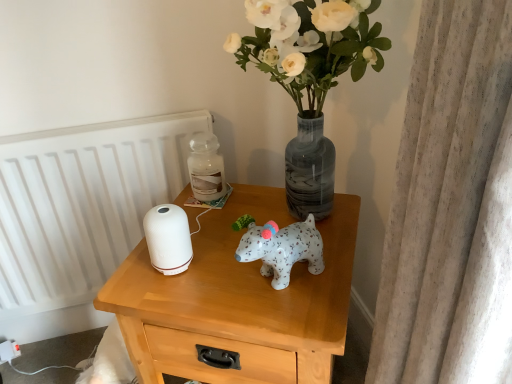
Where is `translucent glass jar at upper center`? translucent glass jar at upper center is located at coordinates (206, 168).

Identify the location of white glossy radiator at left. This screenshot has width=512, height=384. (83, 203).

What do you see at coordinates (310, 46) in the screenshot? I see `white matte vase at upper center` at bounding box center [310, 46].

Where is `translucent glass jar at upper center`? The width and height of the screenshot is (512, 384). translucent glass jar at upper center is located at coordinates (206, 168).

Does white glossy radiator at left turn towards translucent glass jar at upper center?

Yes.

Looking at this image, from the image's perspective, which object appears higher, white glossy radiator at left or translucent glass jar at upper center?

Answer: translucent glass jar at upper center is shown above in the image.

From the picture: Is white glossy radiator at left inside or outside of translucent glass jar at upper center?

white glossy radiator at left is located beyond the bounds of translucent glass jar at upper center.

From the picture: Is white glossy radiator at left wider or thinner than translucent glass jar at upper center?

Considering their sizes, white glossy radiator at left looks slimmer than translucent glass jar at upper center.

Considering the relative positions of white matte nightstand at center and white glossy radiator at left in the image provided, is white matte nightstand at center behind white glossy radiator at left?

No, white matte nightstand at center is closer to the viewer.

From the image's perspective, is white matte nightstand at center located above or below white glossy radiator at left?

From the image's perspective, white matte nightstand at center appears below white glossy radiator at left.

Is white matte nightstand at center taller than white glossy radiator at left?

In fact, white matte nightstand at center may be shorter than white glossy radiator at left.

Can you confirm if white matte nightstand at center is thinner than white glossy radiator at left?

No.

How much distance is there between white matte vase at upper center and white glossy radiator at left?

The distance of white matte vase at upper center from white glossy radiator at left is 21.70 inches.

From a real-world perspective, is white matte vase at upper center under white glossy radiator at left?

No, from a real-world perspective, white matte vase at upper center is not below white glossy radiator at left.

Can you confirm if white matte vase at upper center is wider than white glossy radiator at left?

Indeed, white matte vase at upper center has a greater width compared to white glossy radiator at left.

Choose the correct answer: Is white matte vase at upper center inside white glossy radiator at left or outside it?

white matte vase at upper center is outside white glossy radiator at left.

Is translucent glass jar at upper center aimed at white matte nightstand at center?

No, translucent glass jar at upper center is not facing towards white matte nightstand at center.

Is point (198, 135) closer to camera compared to point (232, 211)?

No, it is not.

Who is taller, translucent glass jar at upper center or white matte nightstand at center?

white matte nightstand at center is taller.

Considering the relative sizes of white matte vase at upper center and translucent glass jar at upper center in the image provided, is white matte vase at upper center taller than translucent glass jar at upper center?

Yes, white matte vase at upper center is taller than translucent glass jar at upper center.

From a real-world perspective, which object rests below the other?

translucent glass jar at upper center is physically lower.

Considering the points (328, 53) and (215, 176), which point is behind, point (328, 53) or point (215, 176)?

Positioned behind is point (215, 176).

Who is smaller, translucent glass jar at upper center or white matte vase at upper center?

translucent glass jar at upper center.

Considering the sizes of objects translucent glass jar at upper center and white matte vase at upper center in the image provided, who is thinner, translucent glass jar at upper center or white matte vase at upper center?

translucent glass jar at upper center.

From the image's perspective, which one is positioned lower, translucent glass jar at upper center or white matte vase at upper center?

translucent glass jar at upper center.

Considering the positions of objects translucent glass jar at upper center and white matte vase at upper center in the image provided, who is in front, translucent glass jar at upper center or white matte vase at upper center?

white matte vase at upper center.

Could you tell me if white glossy radiator at left is facing white matte nightstand at center?

Yes, white glossy radiator at left is oriented towards white matte nightstand at center.

Considering the positions of point (165, 186) and point (329, 279), is point (165, 186) closer or farther from the camera than point (329, 279)?

Point (165, 186) is positioned farther from the camera compared to point (329, 279).

Is white glossy radiator at left at the left side of white matte nightstand at center?

Correct, you'll find white glossy radiator at left to the left of white matte nightstand at center.

The width and height of the screenshot is (512, 384). In order to click on radiator lying above the white matte nightstand at center (from the image's perspective) in this screenshot , I will do `click(83, 203)`.

Identify the location of radiator lying on the left of translucent glass jar at upper center. (83, 203).

Locate an element on the screen. radiator above the white matte nightstand at center (from a real-world perspective) is located at coordinates [83, 203].

Which object lies further to the anchor point white glossy radiator at left, white matte nightstand at center or white matte vase at upper center?

white matte vase at upper center lies further to white glossy radiator at left than the other object.

Considering their positions, is white matte nightstand at center positioned further to white matte vase at upper center than translucent glass jar at upper center?

translucent glass jar at upper center is positioned further to the anchor white matte vase at upper center.

Considering their positions, is white matte nightstand at center positioned closer to translucent glass jar at upper center than white matte vase at upper center?

white matte nightstand at center.

From the image, which object appears to be nearer to white glossy radiator at left, white matte vase at upper center or translucent glass jar at upper center?

translucent glass jar at upper center is positioned closer to the anchor white glossy radiator at left.

From the image, which object appears to be nearer to white matte nightstand at center, white glossy radiator at left or translucent glass jar at upper center?

Among the two, translucent glass jar at upper center is located nearer to white matte nightstand at center.

Estimate the real-world distances between objects in this image. Which object is further from translucent glass jar at upper center, white glossy radiator at left or white matte vase at upper center?

white glossy radiator at left is further to translucent glass jar at upper center.

When comparing their distances from translucent glass jar at upper center, does white glossy radiator at left or white matte nightstand at center seem closer?

Among the two, white matte nightstand at center is located nearer to translucent glass jar at upper center.

Looking at this image, when comparing their distances from white matte vase at upper center, does white glossy radiator at left or white matte nightstand at center seem closer?

white matte nightstand at center.

Identify the location of bottle between white matte vase at upper center and white matte nightstand at center in the vertical direction. This screenshot has height=384, width=512. (206, 168).

Where is `bottle between white glossy radiator at left and white matte vase at upper center`? The height and width of the screenshot is (384, 512). bottle between white glossy radiator at left and white matte vase at upper center is located at coordinates (206, 168).

The height and width of the screenshot is (384, 512). I want to click on bottle between white glossy radiator at left and white matte nightstand at center from left to right, so click(x=206, y=168).

You are a GUI agent. You are given a task and a screenshot of the screen. Output one action in this format:
    pyautogui.click(x=<x>, y=<y>)
    Task: Click on the nightstand between white glossy radiator at left and white matte vase at upper center in the horizontal direction
    
    Given the screenshot: What is the action you would take?
    pyautogui.click(x=237, y=301)